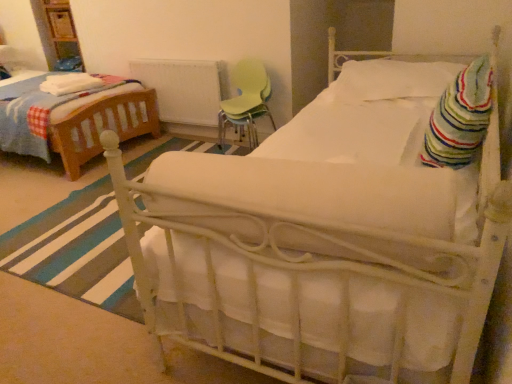
Question: From the image's perspective, does striped cotton blanket at right, the 2th blanket in the back-to-front sequence, appear higher than white soft pillow at upper right?

Choices:
 (A) yes
 (B) no

Answer: (B)

Question: Considering the relative sizes of striped cotton blanket at right, arranged as the second blanket when viewed from the top, and white soft pillow at upper right in the image provided, is striped cotton blanket at right, arranged as the second blanket when viewed from the top, thinner than white soft pillow at upper right?

Choices:
 (A) yes
 (B) no

Answer: (A)

Question: Can white soft pillow at upper right be found inside striped cotton blanket at right, acting as the 1th blanket starting from the right?

Choices:
 (A) yes
 (B) no

Answer: (B)

Question: Considering the relative sizes of striped cotton blanket at right, arranged as the second blanket when viewed from the top, and white soft pillow at upper right in the image provided, is striped cotton blanket at right, arranged as the second blanket when viewed from the top, bigger than white soft pillow at upper right?

Choices:
 (A) no
 (B) yes

Answer: (A)

Question: Is striped cotton blanket at right, the 2th blanket from the left, at the right side of white soft pillow at upper right?

Choices:
 (A) yes
 (B) no

Answer: (B)

Question: Considering the relative sizes of striped cotton blanket at right, arranged as the second blanket when viewed from the top, and white soft pillow at upper right in the image provided, is striped cotton blanket at right, arranged as the second blanket when viewed from the top, shorter than white soft pillow at upper right?

Choices:
 (A) yes
 (B) no

Answer: (B)

Question: Is white painted metal radiator at center turned away from white soft pillow at upper right?

Choices:
 (A) no
 (B) yes

Answer: (A)

Question: Considering the relative positions of white painted metal radiator at center and white soft pillow at upper right in the image provided, is white painted metal radiator at center behind white soft pillow at upper right?

Choices:
 (A) yes
 (B) no

Answer: (A)

Question: Does white painted metal radiator at center appear on the left side of white soft pillow at upper right?

Choices:
 (A) yes
 (B) no

Answer: (A)

Question: From the image's perspective, is white painted metal radiator at center located beneath white soft pillow at upper right?

Choices:
 (A) no
 (B) yes

Answer: (A)

Question: Is white painted metal radiator at center thinner than white soft pillow at upper right?

Choices:
 (A) yes
 (B) no

Answer: (A)

Question: Can you confirm if white painted metal radiator at center is shorter than white soft pillow at upper right?

Choices:
 (A) yes
 (B) no

Answer: (B)

Question: Is striped cotton blanket at right, arranged as the second blanket when viewed from the top, far from white soft blanket at left, which is the 1th blanket in back-to-front order?

Choices:
 (A) no
 (B) yes

Answer: (B)